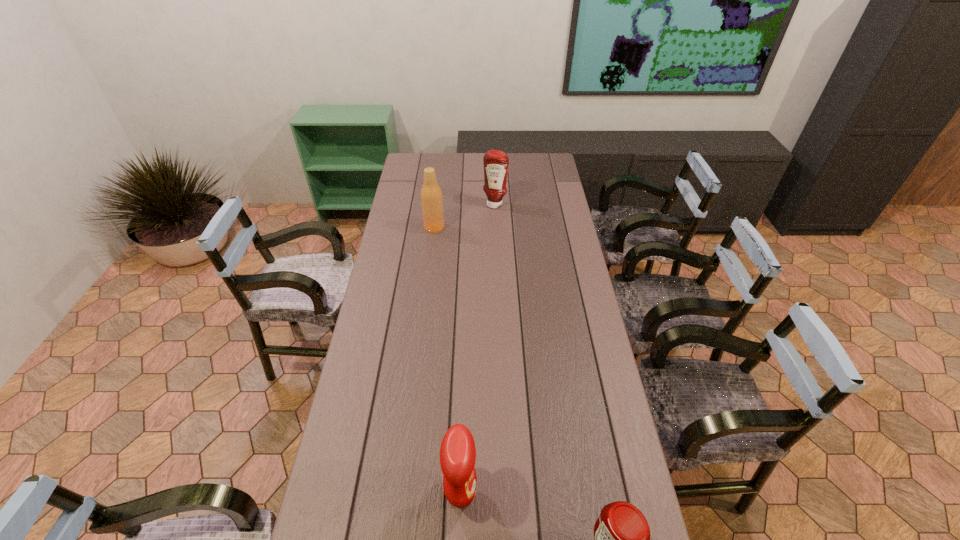
This screenshot has height=540, width=960. I want to click on object that ranks as the closest to the rightmost condiment, so click(x=457, y=452).

At what (x,y) coordinates should I click in order to perform the action: click on condiment that is the second closest to the leftmost object. Please return your answer as a coordinate pair (x, y). The width and height of the screenshot is (960, 540). Looking at the image, I should click on (457, 452).

Locate which condiment ranks in proximity to the third farthest object. Please provide its 2D coordinates. Your answer should be formatted as a tuple, i.e. [(x, y)], where the tuple contains the x and y coordinates of a point satisfying the conditions above.

[(622, 537)]

Locate an element on the screen. The width and height of the screenshot is (960, 540). free space that satisfies the following two spatial constraints: 1. on the back side of the leftmost object; 2. on the right side of the second condiment from right to left is located at coordinates (437, 204).